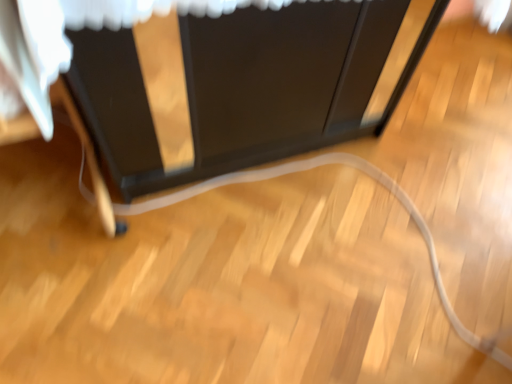
In order to face matte black cabinet at center, should I rotate leftwards or rightwards?

To align with it, rotate left about 0.210°.

This screenshot has width=512, height=384. What are the coordinates of `matte black cabinet at center` in the screenshot? It's located at (249, 85).

What do you see at coordinates (249, 85) in the screenshot? The width and height of the screenshot is (512, 384). I see `matte black cabinet at center` at bounding box center [249, 85].

The height and width of the screenshot is (384, 512). Find the location of `matte black cabinet at center`. matte black cabinet at center is located at coordinates (249, 85).